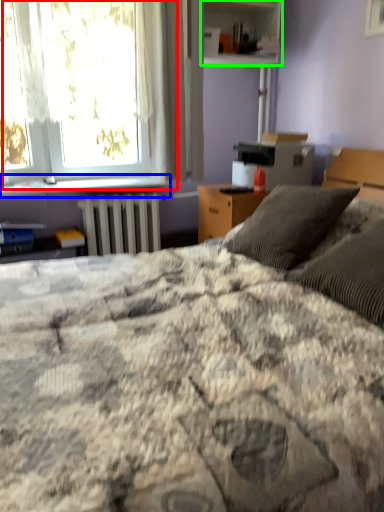
Question: Estimate the real-world distances between objects in this image. Which object is farther from window (highlighted by a red box), window sill (highlighted by a blue box) or shelf (highlighted by a green box)?

Choices:
 (A) window sill
 (B) shelf

Answer: (B)